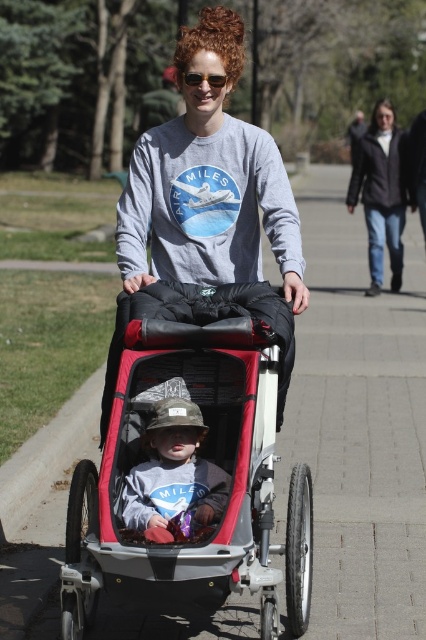
Describe the element at coordinates (207, 182) in the screenshot. I see `matte gray shirt at center` at that location.

Locate an element on the screen. matte gray shirt at center is located at coordinates (207, 182).

Can you confirm if dark gray leather jacket at upper center is positioned below dark gray fleece sweatshirt at upper right?

No, dark gray leather jacket at upper center is not below dark gray fleece sweatshirt at upper right.

Does point (368, 288) come farther from viewer compared to point (385, 164)?

Yes, it is.

Locate an element on the screen. dark gray leather jacket at upper center is located at coordinates (382, 193).

I want to click on dark gray leather jacket at upper center, so click(382, 193).

This screenshot has width=426, height=640. Describe the element at coordinates (380, 172) in the screenshot. I see `dark gray fleece sweatshirt at upper right` at that location.

Does point (357, 193) come closer to viewer compared to point (210, 83)?

No, (357, 193) is behind (210, 83).

The width and height of the screenshot is (426, 640). Describe the element at coordinates (380, 172) in the screenshot. I see `dark gray fleece sweatshirt at upper right` at that location.

Identify the location of dark gray fleece sweatshirt at upper right. (380, 172).